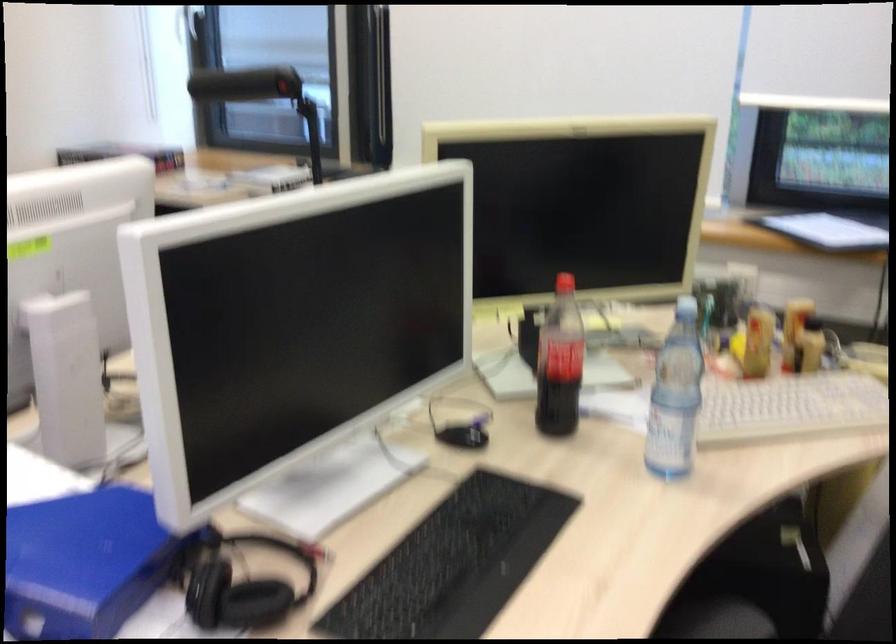
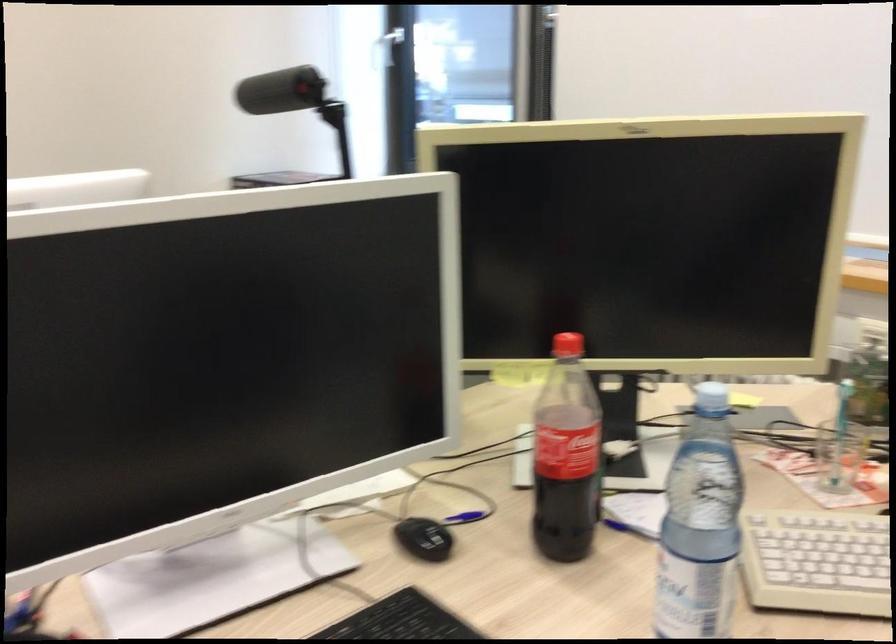
Find the pixel in the second image that matches point (683, 308) in the first image.

(711, 398)